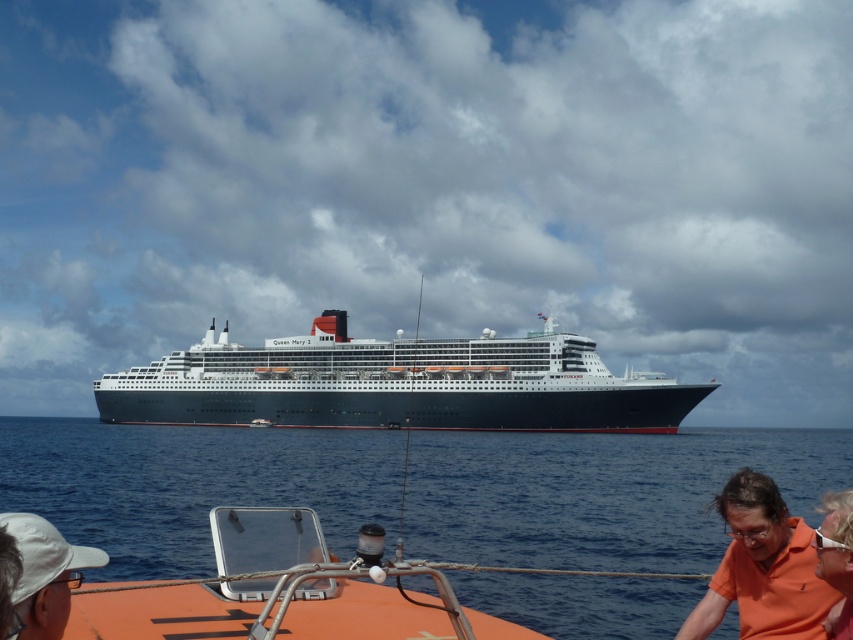
Who is more forward, (381, 470) or (544, 376)?

Point (381, 470) is in front.

Looking at this image, which is above, blue water at center or dark blue metallic ship at center?

dark blue metallic ship at center is higher up.

Which is in front, point (747, 461) or point (380, 353)?

Positioned in front is point (747, 461).

Find the location of a particular element. The image size is (853, 640). blue water at center is located at coordinates (602, 493).

Is dark blue metallic ship at center to the left of white fabric cap at lower left from the viewer's perspective?

No, dark blue metallic ship at center is not to the left of white fabric cap at lower left.

Which is behind, point (352, 355) or point (10, 515)?

The point (352, 355) is more distant.

Where is `dark blue metallic ship at center`? The height and width of the screenshot is (640, 853). dark blue metallic ship at center is located at coordinates (397, 385).

Is dark blue metallic ship at center below orange cotton shirt at lower right?

No.

Does point (219, 380) lie in front of point (711, 509)?

No, (219, 380) is behind (711, 509).

You are a GUI agent. You are given a task and a screenshot of the screen. Output one action in this format:
    pyautogui.click(x=<x>, y=<y>)
    Task: Click on the dark blue metallic ship at center
    The width and height of the screenshot is (853, 640).
    Given the screenshot: What is the action you would take?
    pyautogui.click(x=397, y=385)

Find the location of a particular element. This screenshot has width=853, height=640. dark blue metallic ship at center is located at coordinates (397, 385).